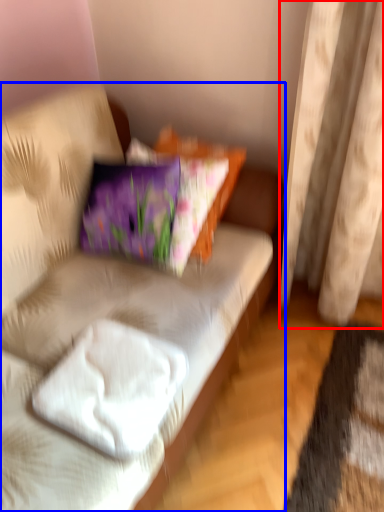
Question: Which object is closer to the camera taking this photo, curtain (highlighted by a red box) or studio couch (highlighted by a blue box)?

Choices:
 (A) curtain
 (B) studio couch

Answer: (B)